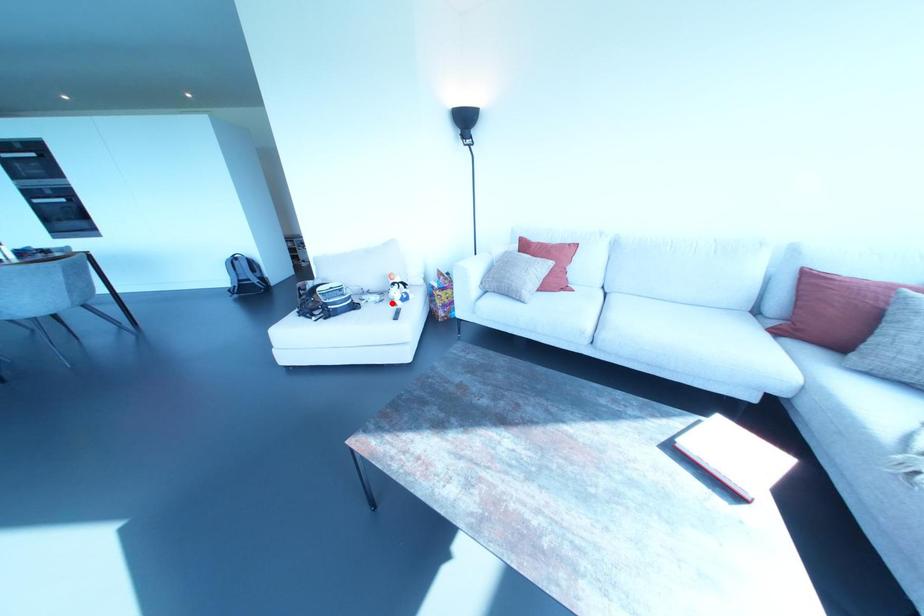
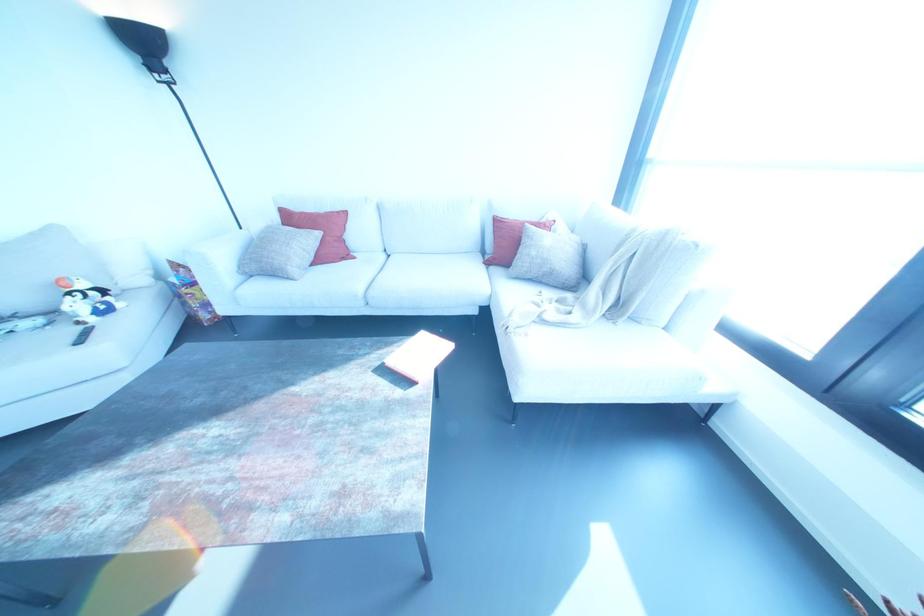
Question: I am providing you with two images of the same scene from different viewpoints. A red point is marked on the first image. At the location where the point appears in image 1, is it still visible in image 2?

Choices:
 (A) Yes
 (B) No

Answer: (A)